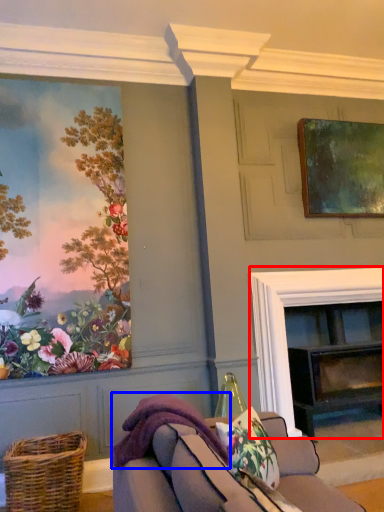
Question: Which point is further to the camera, fireplace (highlighted by a red box) or blanket (highlighted by a blue box)?

Choices:
 (A) fireplace
 (B) blanket

Answer: (A)